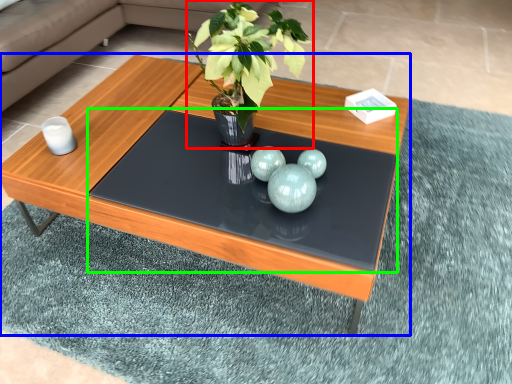
Question: Which is farther away from houseplant (highlighted by a red box)? coffee table (highlighted by a blue box) or glass table (highlighted by a green box)?

Choices:
 (A) coffee table
 (B) glass table

Answer: (A)